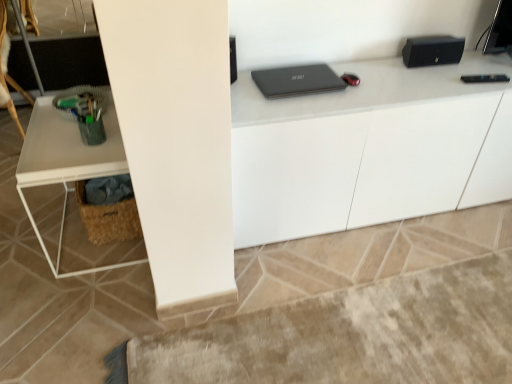
What are the coordinates of `vacant point to the left of woven brown basket at lower left` in the screenshot? It's located at (39, 230).